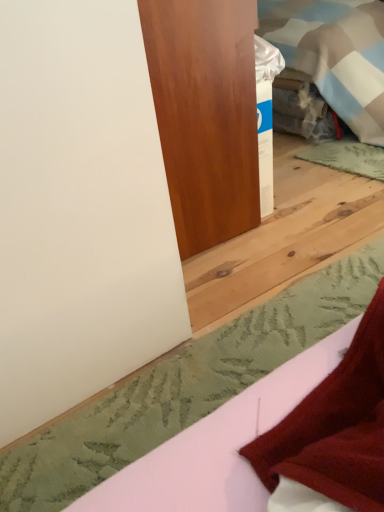
The image size is (384, 512). I want to click on vacant area located to the right-hand side of satin wood door at upper center, so click(x=312, y=189).